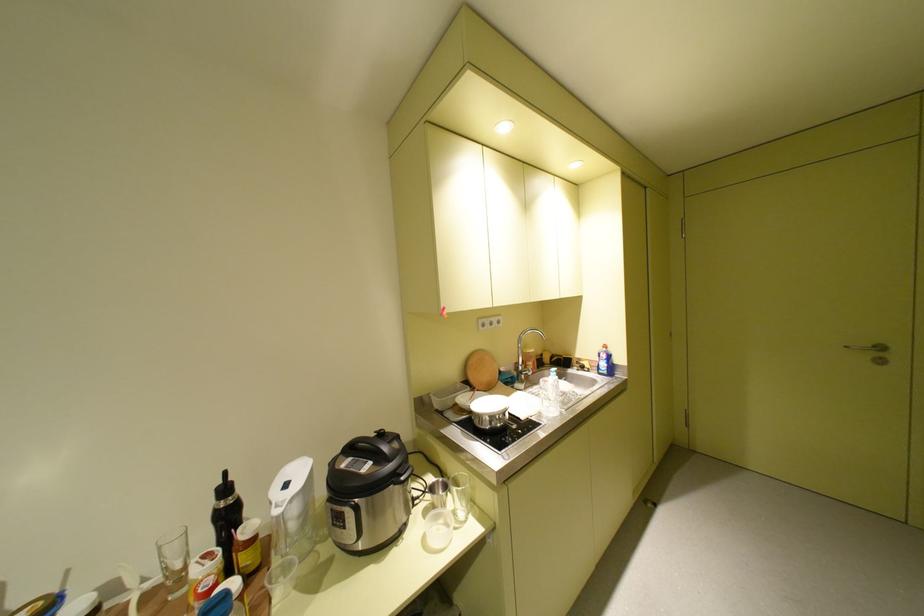
The image size is (924, 616). In order to click on sink faucet handle in this screenshot , I will do `click(526, 375)`.